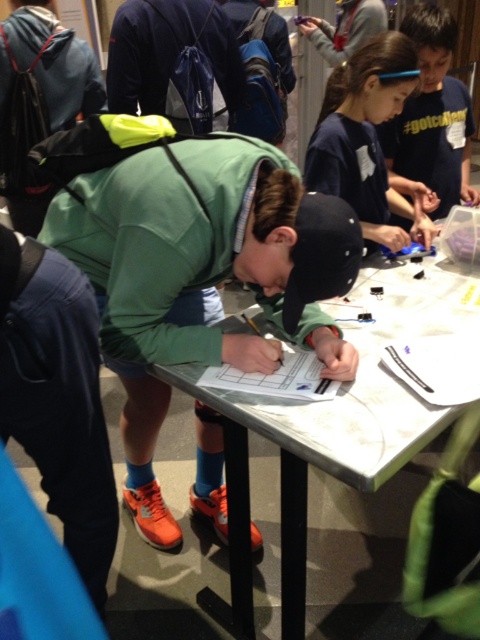
You are organizing a clothing donation drive and need to categorize shirts based on their sizes. You have two shirts in front of you on the table. One is a green matte shirt at center and the other is a dark blue shirt at upper center. Which shirt should you place in the larger size bin?

The green matte shirt at center should be placed in the larger size bin because its width surpasses that of the dark blue shirt at upper center.

What object is located at the coordinates point (328,433)?

The white plastic table at center is located at point (328,433).